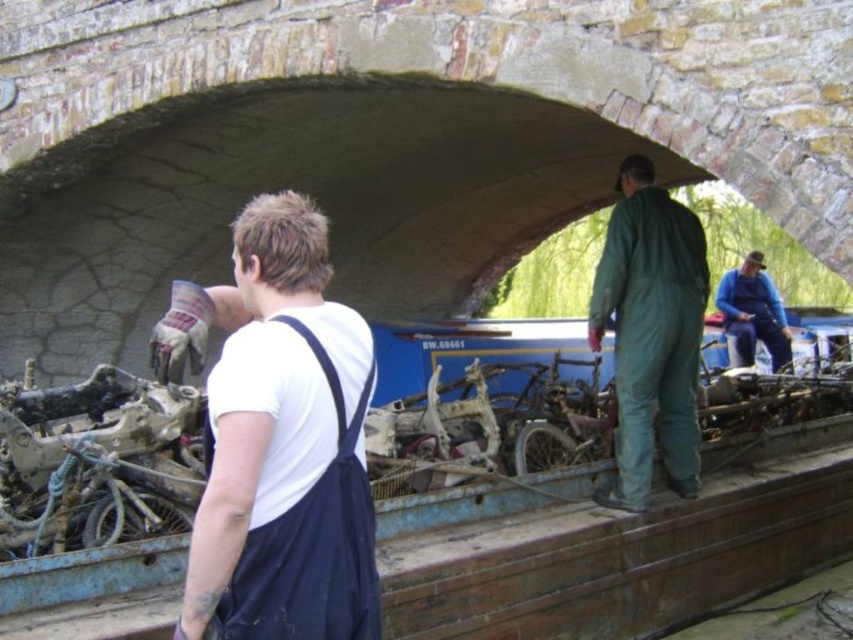
Question: Which of the following is the farthest from the observer?

Choices:
 (A) (762, 272)
 (B) (322, 540)

Answer: (A)

Question: Which point is farther to the camera?

Choices:
 (A) (328, 356)
 (B) (664, 460)
 (C) (759, 310)

Answer: (C)

Question: Is white matte shirt at center below green matte jumpsuit at center?

Choices:
 (A) yes
 (B) no

Answer: (B)

Question: From the image, what is the correct spatial relationship of green matte jumpsuit at center in relation to blue denim overalls at center?

Choices:
 (A) left
 (B) right

Answer: (A)

Question: Is white matte shirt at center bigger than green matte jumpsuit at center?

Choices:
 (A) yes
 (B) no

Answer: (A)

Question: Which of the following is the closest to the observer?

Choices:
 (A) (x=699, y=436)
 (B) (x=316, y=332)

Answer: (B)